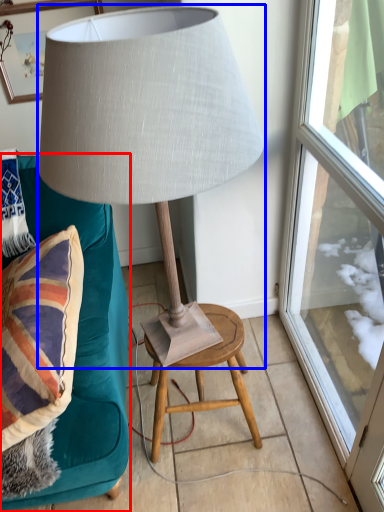
Question: Which of the following is the closest to the observer, furniture (highlighted by a red box) or lamp (highlighted by a blue box)?

Choices:
 (A) furniture
 (B) lamp

Answer: (B)